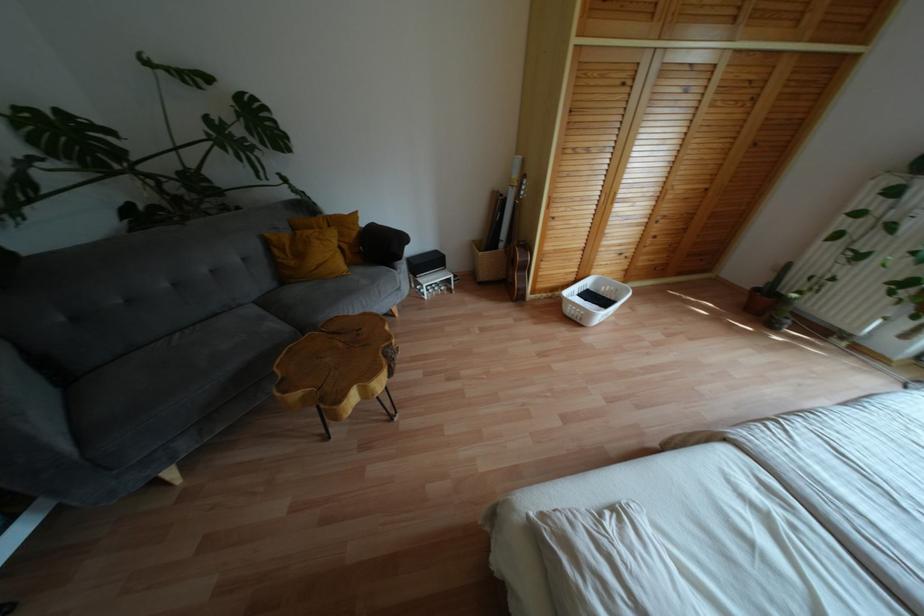
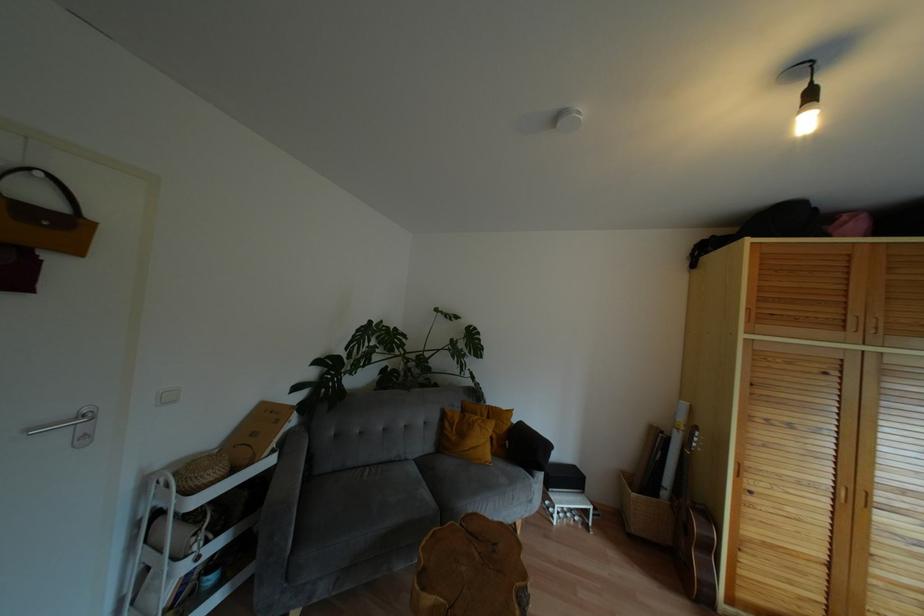
Where in the second image is the point corresponding to (343,267) from the first image?

(488, 456)